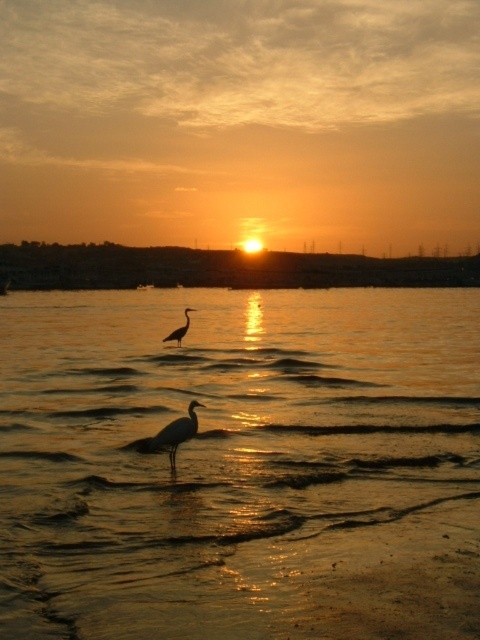
How far apart are matte gray bird at center and silvery white bird at center?

matte gray bird at center is 34.87 feet away from silvery white bird at center.

Does point (176, 429) lie behind point (176, 332)?

No.

At what (x,y) coordinates should I click in order to perform the action: click on matte gray bird at center. Please return your answer as a coordinate pair (x, y). This screenshot has width=480, height=640. Looking at the image, I should click on (173, 433).

Is point (463, 579) closer to camera compared to point (188, 410)?

Yes, it is.

Describe the element at coordinates (240, 465) in the screenshot. I see `golden reflective water at center` at that location.

Between point (206, 292) and point (184, 428), which one is positioned behind?

Positioned behind is point (206, 292).

Locate an element on the screen. golden reflective water at center is located at coordinates (240, 465).

Can you confirm if golden reflective water at center is shorter than silvery white bird at center?

Incorrect, golden reflective water at center's height does not fall short of silvery white bird at center's.

Does point (414, 486) come farther from viewer compared to point (188, 326)?

No, it is in front of (188, 326).

Locate an element on the screen. golden reflective water at center is located at coordinates (240, 465).